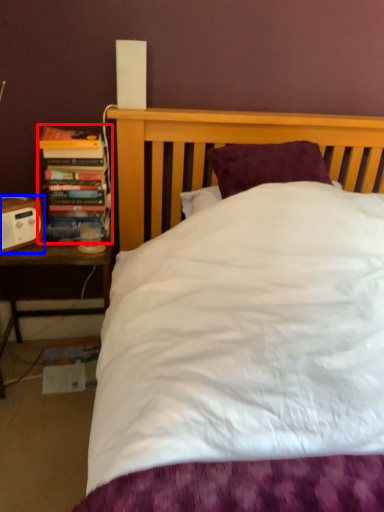
Question: Among these objects, which one is nearest to the camera, book (highlighted by a red box) or speaker (highlighted by a blue box)?

Choices:
 (A) book
 (B) speaker

Answer: (B)